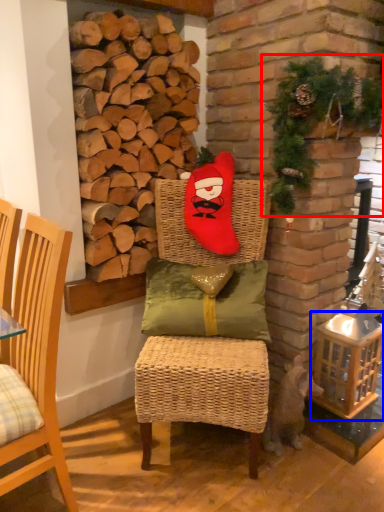
Question: Which object appears closest to the camera in this image, christmas decoration (highlighted by a red box) or basket (highlighted by a blue box)?

Choices:
 (A) christmas decoration
 (B) basket

Answer: (A)